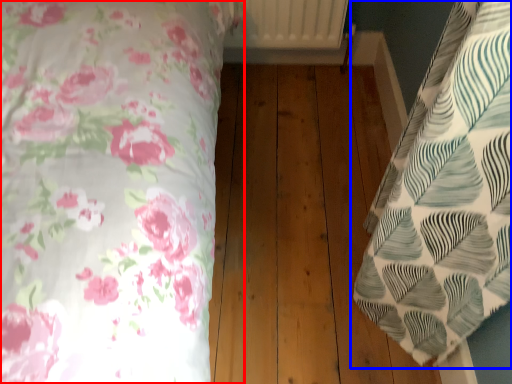
Question: Which object is closer to the camera taking this photo, bed (highlighted by a red box) or bed (highlighted by a blue box)?

Choices:
 (A) bed
 (B) bed

Answer: (A)